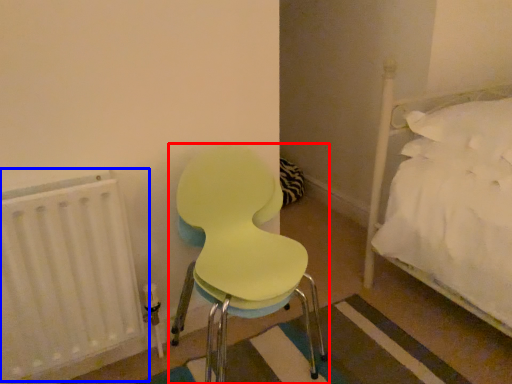
Question: Which point is further to the camera, chair (highlighted by a red box) or radiator (highlighted by a blue box)?

Choices:
 (A) chair
 (B) radiator

Answer: (B)